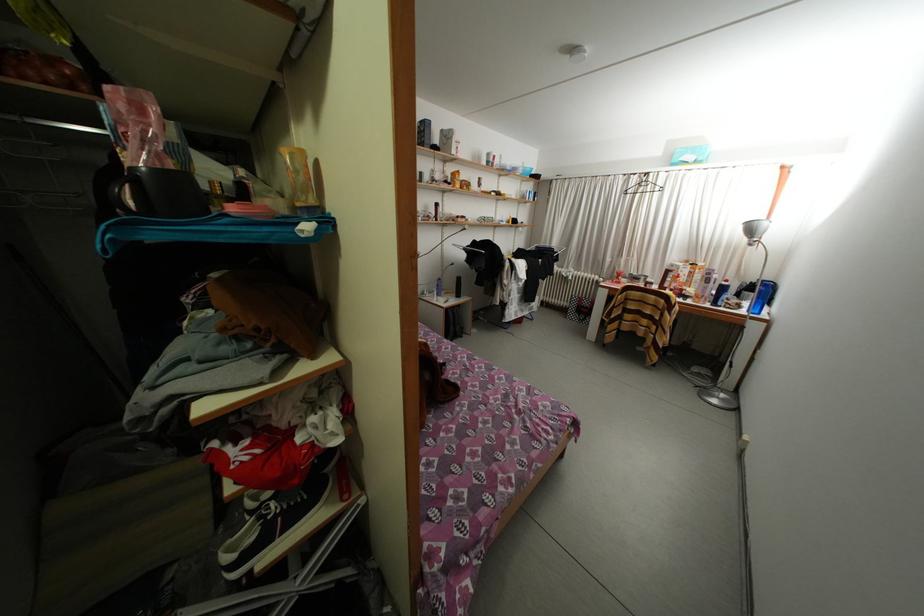
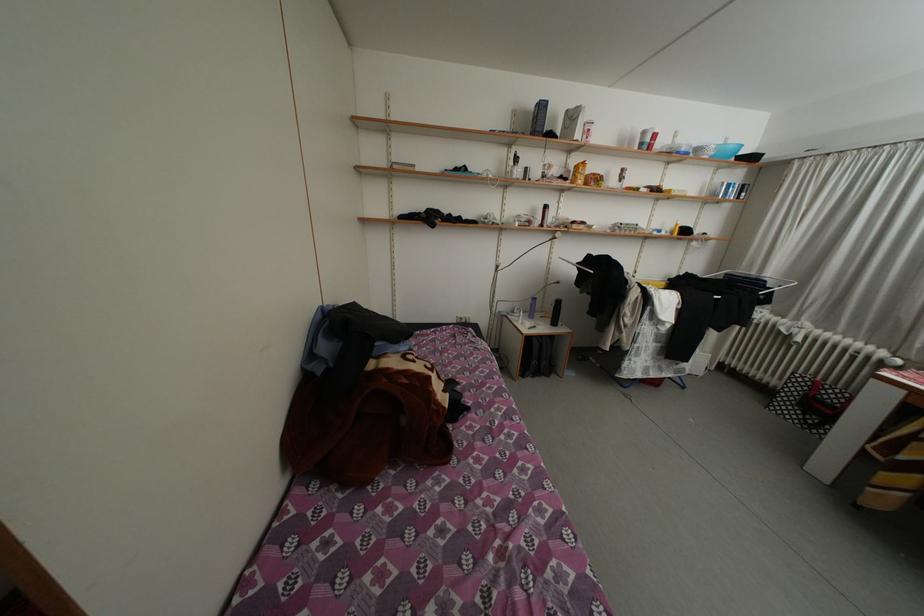
In the second image, find the point that corresponds to (x=495, y=167) in the first image.

(650, 148)